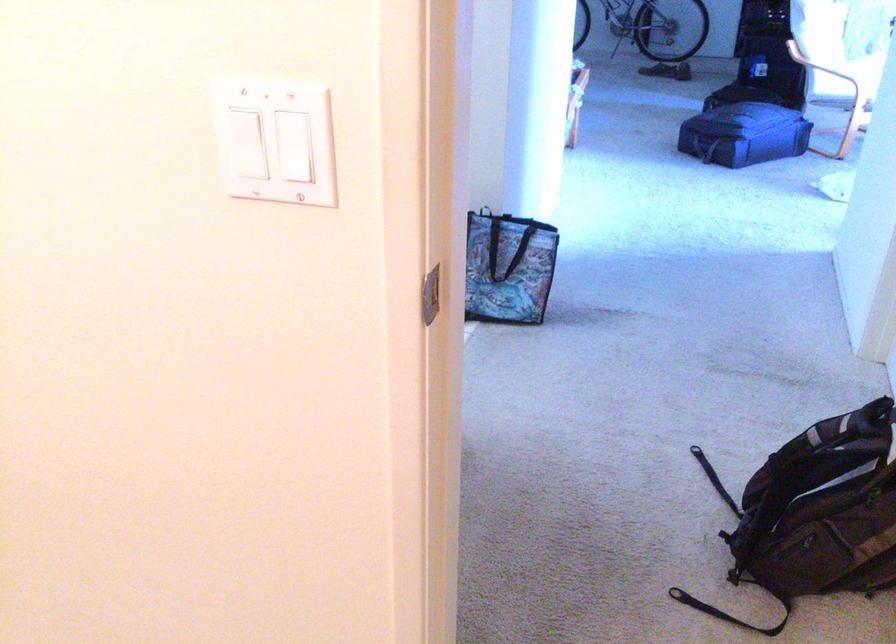
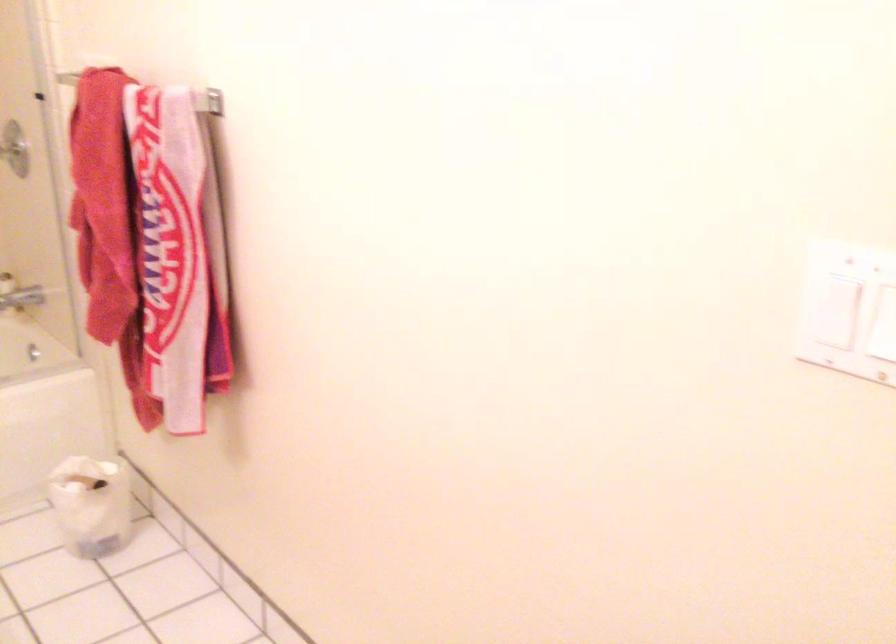
In the second image, find the point that corresponds to point 234,134 in the first image.

(831, 295)